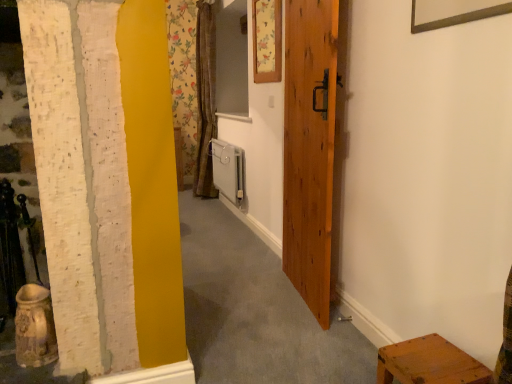
Locate an element on the screen. white plastic radiator at center is located at coordinates (228, 170).

The width and height of the screenshot is (512, 384). What do you see at coordinates (228, 170) in the screenshot? I see `white plastic radiator at center` at bounding box center [228, 170].

This screenshot has height=384, width=512. What do you see at coordinates (267, 40) in the screenshot? I see `floral paper picture frame at upper center` at bounding box center [267, 40].

In order to click on white plastic radiator at center in this screenshot , I will do `click(228, 170)`.

From a real-world perspective, which is physically above, wooden stool at lower right or white plastic radiator at center?

white plastic radiator at center, from a real-world perspective.

From the image's perspective, does wooden stool at lower right appear higher than white plastic radiator at center?

Incorrect, from the image's perspective, wooden stool at lower right is lower than white plastic radiator at center.

From the picture: Are wooden stool at lower right and white plastic radiator at center located far from each other?

wooden stool at lower right is positioned a significant distance from white plastic radiator at center.

Considering the relative positions of wooden stool at lower right and white plastic radiator at center in the image provided, is wooden stool at lower right behind white plastic radiator at center?

No.

Is white plastic radiator at center far away from wooden stool at lower right?

white plastic radiator at center is far away from wooden stool at lower right.

From the picture: Measure the distance from white plastic radiator at center to wooden stool at lower right.

white plastic radiator at center and wooden stool at lower right are 2.74 meters apart.

Considering the sizes of objects white plastic radiator at center and wooden stool at lower right in the image provided, who is bigger, white plastic radiator at center or wooden stool at lower right?

white plastic radiator at center is bigger.

Considering the sizes of objects white plastic radiator at center and wooden stool at lower right in the image provided, who is taller, white plastic radiator at center or wooden stool at lower right?

white plastic radiator at center.

What's the angular difference between wooden stool at lower right and floral paper picture frame at upper center's facing directions?

They differ by 2.3 degrees in their facing directions.

Locate an element on the screen. The height and width of the screenshot is (384, 512). picture frame that is above the wooden stool at lower right (from a real-world perspective) is located at coordinates pos(267,40).

Choose the correct answer: Is wooden stool at lower right inside floral paper picture frame at upper center or outside it?

wooden stool at lower right is not enclosed by floral paper picture frame at upper center.

Is floral paper picture frame at upper center turned away from wooden door at center?

floral paper picture frame at upper center does not have its back to wooden door at center.

From the image's perspective, is floral paper picture frame at upper center under wooden door at center?

No, from the image's perspective, floral paper picture frame at upper center is not below wooden door at center.

From the picture: Is floral paper picture frame at upper center positioned beyond the bounds of wooden door at center?

floral paper picture frame at upper center lies outside wooden door at center's area.

Would you say floral paper picture frame at upper center is a long distance from wooden stool at lower right?

Yes, floral paper picture frame at upper center and wooden stool at lower right are quite far apart.

Is floral paper picture frame at upper center smaller than wooden stool at lower right?

Yes, floral paper picture frame at upper center is smaller than wooden stool at lower right.

Based on the photo, from a real-world perspective, is floral paper picture frame at upper center physically below wooden stool at lower right?

No, from a real-world perspective, floral paper picture frame at upper center is not below wooden stool at lower right.

Looking at this image, from a real-world perspective, relative to wooden door at center, is white plastic radiator at center vertically above or below?

In terms of real-world spatial position, white plastic radiator at center is below wooden door at center.

In the scene shown: Who is taller, white plastic radiator at center or wooden door at center?

With more height is wooden door at center.

The width and height of the screenshot is (512, 384). I want to click on radiator behind the wooden door at center, so coord(228,170).

Consider the image. From the image's perspective, which is below, white plastic radiator at center or wooden door at center?

white plastic radiator at center, from the image's perspective.

This screenshot has height=384, width=512. What are the coordinates of `door above the wooden stool at lower right (from the image's perspective)` in the screenshot? It's located at (x=309, y=148).

Is wooden stool at lower right located within wooden door at center?

No, wooden stool at lower right is not surrounded by wooden door at center.

Considering the positions of objects wooden door at center and wooden stool at lower right in the image provided, who is behind, wooden door at center or wooden stool at lower right?

Positioned behind is wooden door at center.

In order to click on furniture located underneath the white plastic radiator at center (from a real-world perspective) in this screenshot , I will do `click(429, 363)`.

This screenshot has width=512, height=384. What are the coordinates of `radiator that appears above the wooden stool at lower right (from a real-world perspective)` in the screenshot? It's located at (228, 170).

From the image, which object appears to be nearer to wooden stool at lower right, floral paper picture frame at upper center or wooden door at center?

Based on the image, wooden door at center appears to be nearer to wooden stool at lower right.

Estimate the real-world distances between objects in this image. Which object is closer to floral paper picture frame at upper center, wooden door at center or white plastic radiator at center?

wooden door at center.

Which object lies nearer to the anchor point wooden stool at lower right, wooden door at center or floral paper picture frame at upper center?

wooden door at center lies closer to wooden stool at lower right than the other object.

Which object lies nearer to the anchor point wooden door at center, floral paper picture frame at upper center or white plastic radiator at center?

floral paper picture frame at upper center is positioned closer to the anchor wooden door at center.

Looking at this image, looking at the image, which one is located further to floral paper picture frame at upper center, white plastic radiator at center or wooden stool at lower right?

wooden stool at lower right is positioned further to the anchor floral paper picture frame at upper center.

Looking at the image, which one is located further to wooden stool at lower right, floral paper picture frame at upper center or white plastic radiator at center?

white plastic radiator at center.

Considering their positions, is white plastic radiator at center positioned closer to wooden stool at lower right than wooden door at center?

wooden door at center lies closer to wooden stool at lower right than the other object.

From the image, which object appears to be nearer to wooden stool at lower right, white plastic radiator at center or floral paper picture frame at upper center?

Among the two, floral paper picture frame at upper center is located nearer to wooden stool at lower right.

The height and width of the screenshot is (384, 512). I want to click on picture frame between wooden stool at lower right and white plastic radiator at center from front to back, so click(x=267, y=40).

Identify the location of door between floral paper picture frame at upper center and wooden stool at lower right in the up-down direction. The width and height of the screenshot is (512, 384). (309, 148).

Image resolution: width=512 pixels, height=384 pixels. Find the location of `picture frame located between wooden door at center and white plastic radiator at center in the depth direction`. picture frame located between wooden door at center and white plastic radiator at center in the depth direction is located at coordinates (267, 40).

Find the location of `door positioned between wooden stool at lower right and white plastic radiator at center from near to far`. door positioned between wooden stool at lower right and white plastic radiator at center from near to far is located at coordinates (309, 148).